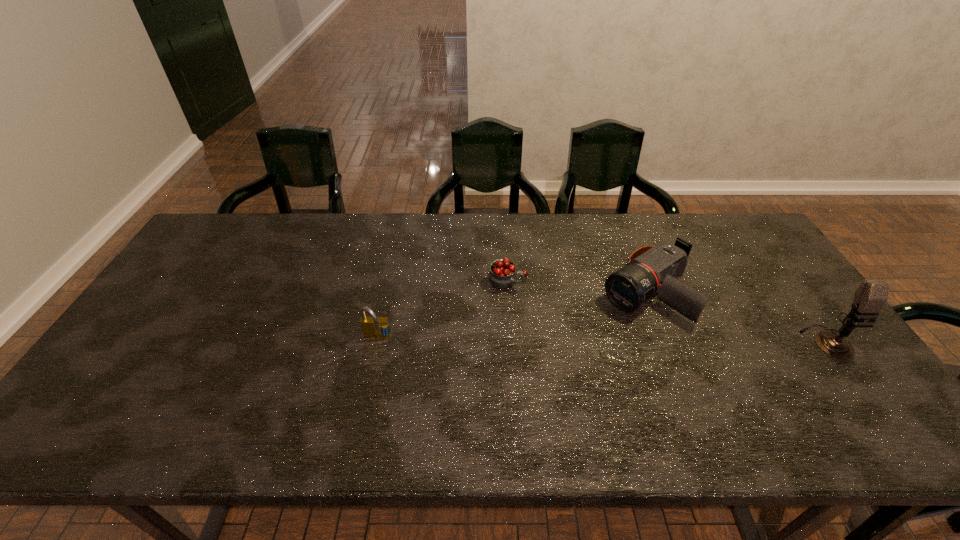
Point out which object is positioned as the second nearest to the leftmost object. Please provide its 2D coordinates. Your answer should be formatted as a tuple, i.e. [(x, y)], where the tuple contains the x and y coordinates of a point satisfying the conditions above.

[(650, 270)]